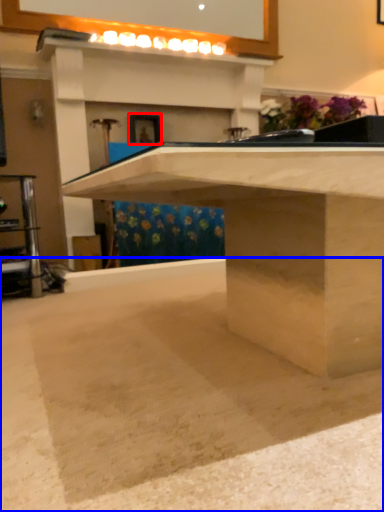
Question: Which point is closer to the camera, picture frame (highlighted by a red box) or concrete (highlighted by a blue box)?

Choices:
 (A) picture frame
 (B) concrete

Answer: (B)